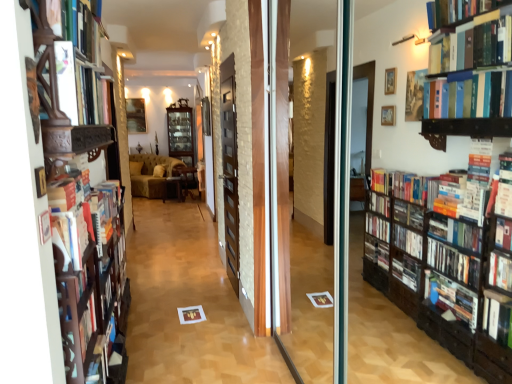
You are a GUI agent. You are given a task and a screenshot of the screen. Output one action in this format:
    pyautogui.click(x=<x>, y=<y>)
    Task: Click on the blank space situated above matte brown paper at center (from a real-world perspective)
    The height and width of the screenshot is (384, 512).
    Given the screenshot: What is the action you would take?
    pyautogui.click(x=193, y=313)